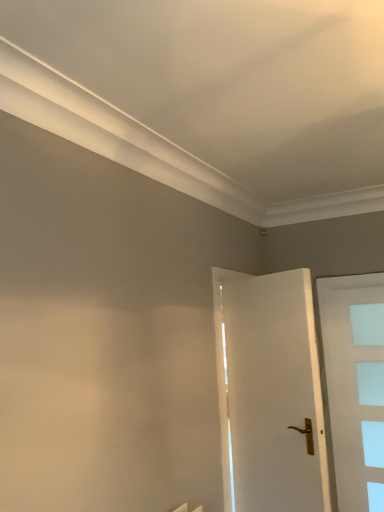
In order to face white glossy door at center, placed as the first door when sorted from left to right, should I rotate leftwards or rightwards?

Rotate your view right by about 10.541°.

This screenshot has height=512, width=384. Identify the location of white glossy door at center, placed as the first door when sorted from left to right. (269, 392).

What do you see at coordinates (269, 392) in the screenshot? The image size is (384, 512). I see `white glossy door at center, positioned as the second door in back-to-front order` at bounding box center [269, 392].

The height and width of the screenshot is (512, 384). Describe the element at coordinates (355, 385) in the screenshot. I see `white frosted glass door at right, which is the first door from back to front` at that location.

What is the approximate height of white frosted glass door at right, marked as the 2th door in a front-to-back arrangement?

white frosted glass door at right, marked as the 2th door in a front-to-back arrangement, is 5.60 feet tall.

Where is `white frosted glass door at right, which is the first door from back to front`? The height and width of the screenshot is (512, 384). white frosted glass door at right, which is the first door from back to front is located at coordinates (355, 385).

Measure the distance between point (351, 331) and camera.

Point (351, 331) and camera are 3.37 meters apart.

The image size is (384, 512). I want to click on white glossy door at center, the 2th door from the right, so click(269, 392).

Which is more to the left, white frosted glass door at right, which is the first door from back to front, or white glossy door at center, positioned as the second door in back-to-front order?

Positioned to the left is white glossy door at center, positioned as the second door in back-to-front order.

Is the position of white frosted glass door at right, which is the first door from back to front, less distant than that of white glossy door at center, placed as the first door when sorted from left to right?

No, it is behind white glossy door at center, placed as the first door when sorted from left to right.

Considering the positions of points (376, 318) and (286, 502), is point (376, 318) closer to camera compared to point (286, 502)?

No, (376, 318) is behind (286, 502).

From the image's perspective, is white frosted glass door at right, marked as the 2th door in a front-to-back arrangement, on top of white glossy door at center, positioned as the second door in back-to-front order?

Actually, white frosted glass door at right, marked as the 2th door in a front-to-back arrangement, appears below white glossy door at center, positioned as the second door in back-to-front order, in the image.

From a real-world perspective, which is physically above, white frosted glass door at right, marked as the 2th door in a front-to-back arrangement, or white glossy door at center, which ranks as the 1th door in front-to-back order?

white glossy door at center, which ranks as the 1th door in front-to-back order, is physically above.

Does white frosted glass door at right, marked as the 2th door in a front-to-back arrangement, have a lesser width compared to white glossy door at center, the 2th door from the right?

Indeed, white frosted glass door at right, marked as the 2th door in a front-to-back arrangement, has a lesser width compared to white glossy door at center, the 2th door from the right.

Is white frosted glass door at right, marked as the 2th door in a front-to-back arrangement, taller than white glossy door at center, which ranks as the 1th door in front-to-back order?

Correct, white frosted glass door at right, marked as the 2th door in a front-to-back arrangement, is much taller as white glossy door at center, which ranks as the 1th door in front-to-back order.

Which of these two, white frosted glass door at right, which appears as the 1th door when viewed from the right, or white glossy door at center, positioned as the second door in back-to-front order, is bigger?

Bigger between the two is white glossy door at center, positioned as the second door in back-to-front order.

Do you think white frosted glass door at right, marked as the 2th door in a front-to-back arrangement, is within white glossy door at center, placed as the first door when sorted from left to right, or outside of it?

white frosted glass door at right, marked as the 2th door in a front-to-back arrangement, is not enclosed by white glossy door at center, placed as the first door when sorted from left to right.

Is white frosted glass door at right, which is the first door from back to front, directly adjacent to white glossy door at center, positioned as the second door in back-to-front order?

There is a gap between white frosted glass door at right, which is the first door from back to front, and white glossy door at center, positioned as the second door in back-to-front order.

Could you tell me if white frosted glass door at right, marked as the 2th door in a front-to-back arrangement, is turned towards white glossy door at center, placed as the first door when sorted from left to right?

Yes, white frosted glass door at right, marked as the 2th door in a front-to-back arrangement, is oriented towards white glossy door at center, placed as the first door when sorted from left to right.

How many degrees apart are the facing directions of white frosted glass door at right, which appears as the 1th door when viewed from the right, and white glossy door at center, which ranks as the 1th door in front-to-back order?

The facing directions of white frosted glass door at right, which appears as the 1th door when viewed from the right, and white glossy door at center, which ranks as the 1th door in front-to-back order, are 151 degrees apart.

How far apart are white frosted glass door at right, which is the first door from back to front, and white glossy door at center, placed as the first door when sorted from left to right?

A distance of 3.60 feet exists between white frosted glass door at right, which is the first door from back to front, and white glossy door at center, placed as the first door when sorted from left to right.

At what (x,y) coordinates should I click in order to perform the action: click on door that appears above the white frosted glass door at right, which is counted as the second door, starting from the left (from a real-world perspective). Please return your answer as a coordinate pair (x, y). The image size is (384, 512). Looking at the image, I should click on (269, 392).

Is white glossy door at center, which ranks as the 1th door in front-to-back order, at the right side of white frosted glass door at right, which is the first door from back to front?

In fact, white glossy door at center, which ranks as the 1th door in front-to-back order, is to the left of white frosted glass door at right, which is the first door from back to front.

Is the position of white glossy door at center, placed as the first door when sorted from left to right, less distant than that of white frosted glass door at right, which appears as the 1th door when viewed from the right?

Yes, white glossy door at center, placed as the first door when sorted from left to right, is in front of white frosted glass door at right, which appears as the 1th door when viewed from the right.

Is point (232, 298) more distant than point (327, 303)?

No, (232, 298) is in front of (327, 303).

From the image's perspective, between white glossy door at center, positioned as the second door in back-to-front order, and white frosted glass door at right, which is counted as the second door, starting from the left, who is located below?

white frosted glass door at right, which is counted as the second door, starting from the left, from the image's perspective.

From a real-world perspective, between white glossy door at center, which ranks as the 1th door in front-to-back order, and white frosted glass door at right, which is counted as the second door, starting from the left, who is vertically higher?

In real-world perspective, white glossy door at center, which ranks as the 1th door in front-to-back order, is above.

Does white glossy door at center, positioned as the second door in back-to-front order, have a greater width compared to white frosted glass door at right, which is the first door from back to front?

Yes.

Considering the sizes of white glossy door at center, positioned as the second door in back-to-front order, and white frosted glass door at right, which is the first door from back to front, in the image, is white glossy door at center, positioned as the second door in back-to-front order, taller or shorter than white frosted glass door at right, which is the first door from back to front,?

white glossy door at center, positioned as the second door in back-to-front order, is shorter than white frosted glass door at right, which is the first door from back to front.

Can you confirm if white glossy door at center, positioned as the second door in back-to-front order, is smaller than white frosted glass door at right, which is counted as the second door, starting from the left?

Actually, white glossy door at center, positioned as the second door in back-to-front order, might be larger than white frosted glass door at right, which is counted as the second door, starting from the left.

Looking at this image, would you say white glossy door at center, placed as the first door when sorted from left to right, is inside or outside white frosted glass door at right, marked as the 2th door in a front-to-back arrangement?

white glossy door at center, placed as the first door when sorted from left to right, is located beyond the bounds of white frosted glass door at right, marked as the 2th door in a front-to-back arrangement.

Can you see white glossy door at center, positioned as the second door in back-to-front order, touching white frosted glass door at right, which is the first door from back to front?

No, white glossy door at center, positioned as the second door in back-to-front order, is not with white frosted glass door at right, which is the first door from back to front.

Is white glossy door at center, which ranks as the 1th door in front-to-back order, aimed at white frosted glass door at right, marked as the 2th door in a front-to-back arrangement?

Yes, white glossy door at center, which ranks as the 1th door in front-to-back order, faces towards white frosted glass door at right, marked as the 2th door in a front-to-back arrangement.

At what (x,y) coordinates should I click in order to perform the action: click on door on the right of white glossy door at center, which ranks as the 1th door in front-to-back order. Please return your answer as a coordinate pair (x, y). The width and height of the screenshot is (384, 512). Looking at the image, I should click on (355, 385).

Locate an element on the screen. Image resolution: width=384 pixels, height=512 pixels. door in front of the white frosted glass door at right, which is counted as the second door, starting from the left is located at coordinates (269, 392).

Locate an element on the screen. The width and height of the screenshot is (384, 512). door behind the white glossy door at center, the 2th door from the right is located at coordinates (355, 385).